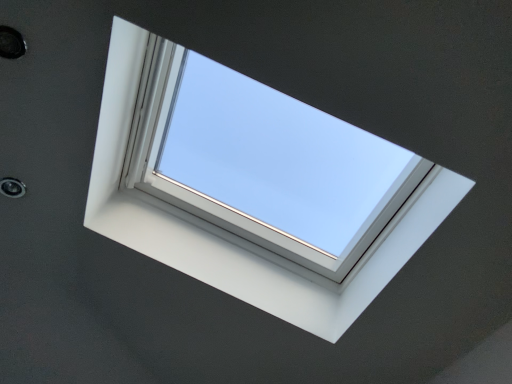
Question: Choose the correct answer: Is white plastic window at center inside metallic circular hole at upper left, which is the second hole from left to right, or outside it?

Choices:
 (A) outside
 (B) inside

Answer: (A)

Question: Considering the positions of white plastic window at center and metallic circular hole at upper left, acting as the second hole starting from the bottom, in the image, is white plastic window at center taller or shorter than metallic circular hole at upper left, acting as the second hole starting from the bottom,?

Choices:
 (A) tall
 (B) short

Answer: (A)

Question: Which is farther from the metallic circular hole at upper left, which is counted as the second hole, starting from the back?

Choices:
 (A) metallic circular hole at upper left, which is the second hole in right-to-left order
 (B) white plastic window at center

Answer: (B)

Question: Which is nearer to the white plastic window at center?

Choices:
 (A) metallic circular hole at upper left, which is the first hole in top-to-bottom order
 (B) metallic circular hole at upper left, placed as the first hole when sorted from back to front

Answer: (B)